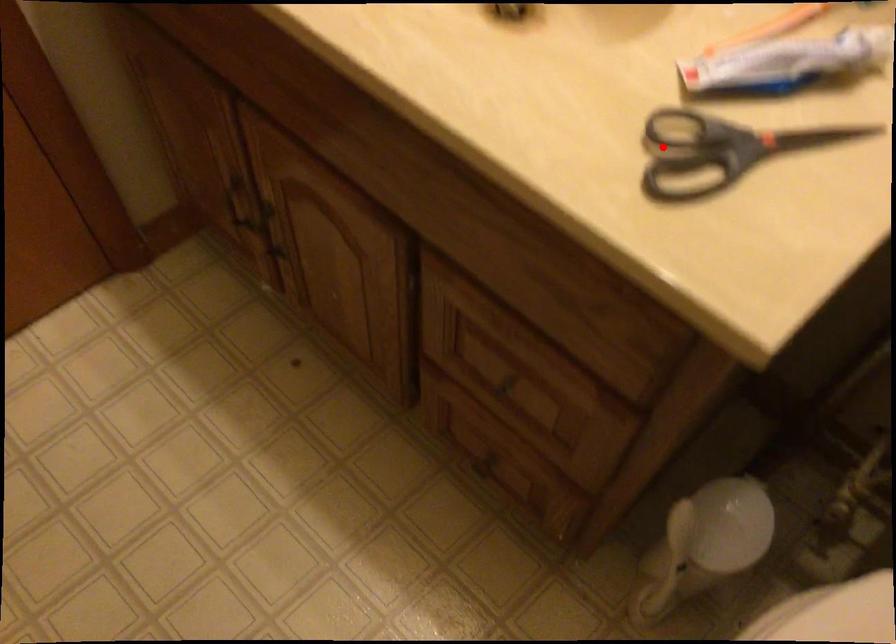
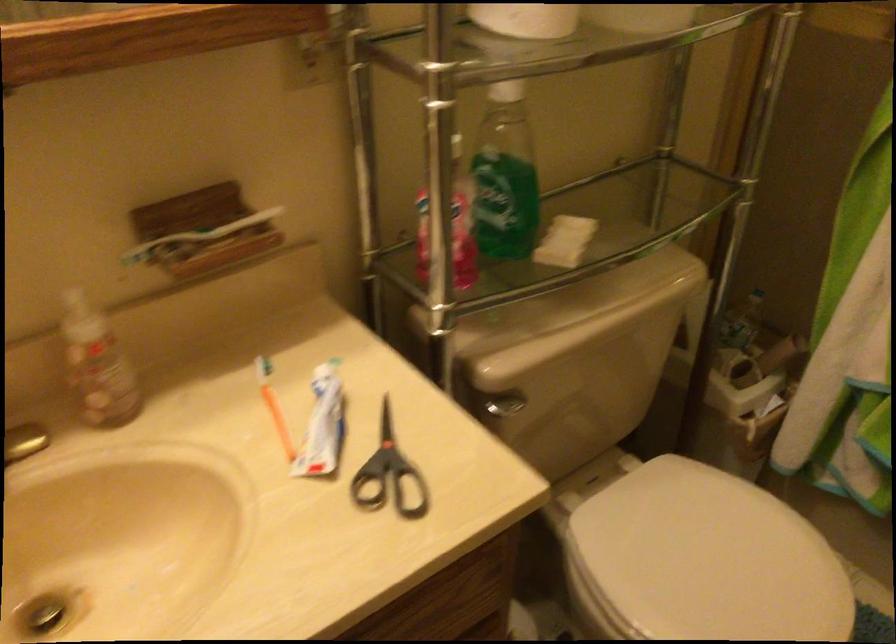
Find the pixel in the second image that matches the highlighted location in the first image.

(391, 489)